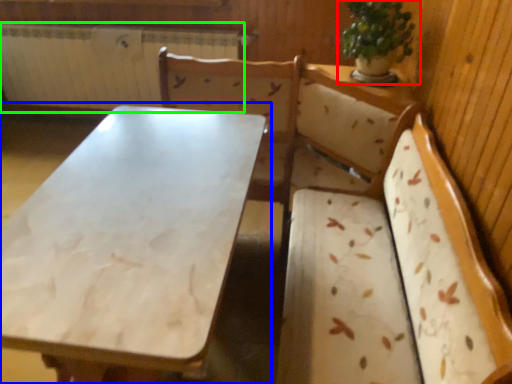
Question: Which object is positioned farthest from houseplant (highlighted by a red box)? Select from table (highlighted by a blue box) and radiator (highlighted by a green box).

Choices:
 (A) table
 (B) radiator

Answer: (B)